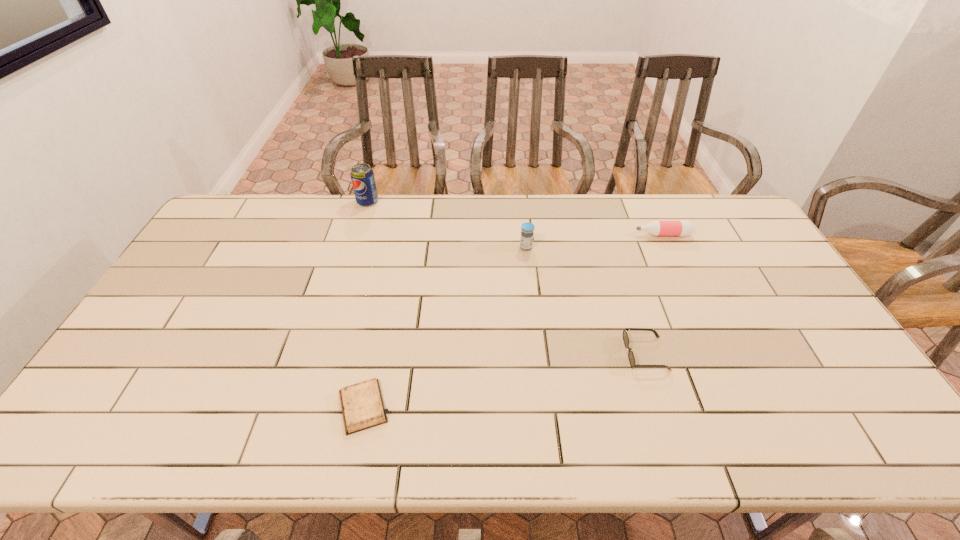
This screenshot has height=540, width=960. What are the coordinates of `object identified as the third closest to the shortest object` in the screenshot? It's located at (362, 176).

Locate an element on the screen. The width and height of the screenshot is (960, 540). free location that satisfies the following two spatial constraints: 1. on the front side of the third object from right to left; 2. on the right side of the soda is located at coordinates 353,247.

You are a GUI agent. You are given a task and a screenshot of the screen. Output one action in this format:
    pyautogui.click(x=<x>, y=<y>)
    Task: Click on the vacant space that satisfies the following two spatial constraints: 1. on the front side of the third nearest object; 2. on the left side of the leftmost object
    The width and height of the screenshot is (960, 540).
    Given the screenshot: What is the action you would take?
    pyautogui.click(x=353, y=247)

Where is `free location that satisfies the following two spatial constraints: 1. on the front side of the leftmost object; 2. on the left side of the shortest object`? free location that satisfies the following two spatial constraints: 1. on the front side of the leftmost object; 2. on the left side of the shortest object is located at coordinates (305, 407).